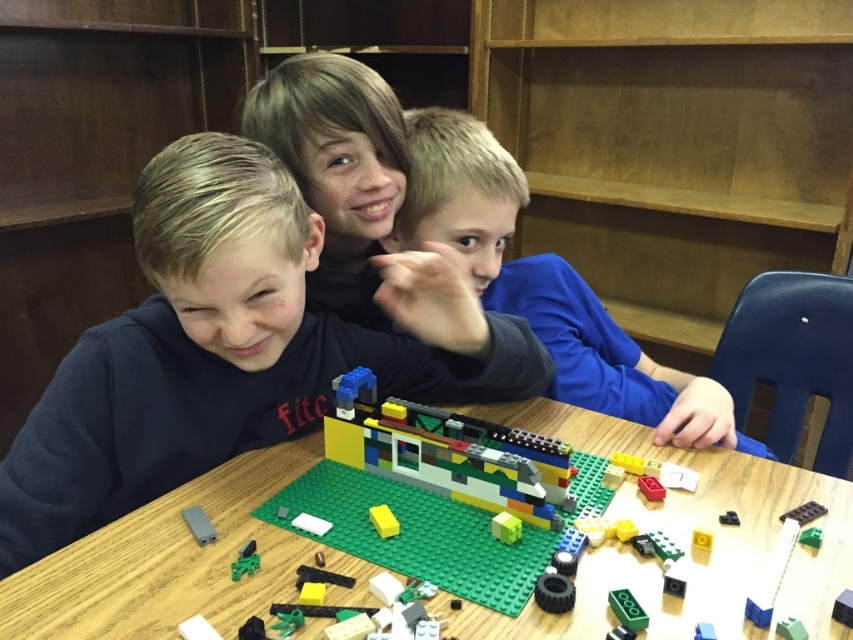
Question: In this image, where is dark blue sweatshirt at left located relative to green plastic table at center?

Choices:
 (A) above
 (B) below

Answer: (A)

Question: Which object appears closest to the camera in this image?

Choices:
 (A) green plastic table at center
 (B) green plastic toy at center

Answer: (A)

Question: Among these objects, which one is farthest from the camera?

Choices:
 (A) black plastic car at center
 (B) green plastic table at center
 (C) wooden bookshelf at upper center

Answer: (C)

Question: Observing the image, what is the correct spatial positioning of green matte brick at center in reference to yellow matte brick at center?

Choices:
 (A) left
 (B) right

Answer: (B)

Question: Which is farther from the green matte brick at center?

Choices:
 (A) dark blue sweatshirt at left
 (B) smooth plastic lego set at center

Answer: (B)

Question: Is smooth plastic lego set at center positioned before matte gray plastic piece at center?

Choices:
 (A) yes
 (B) no

Answer: (B)